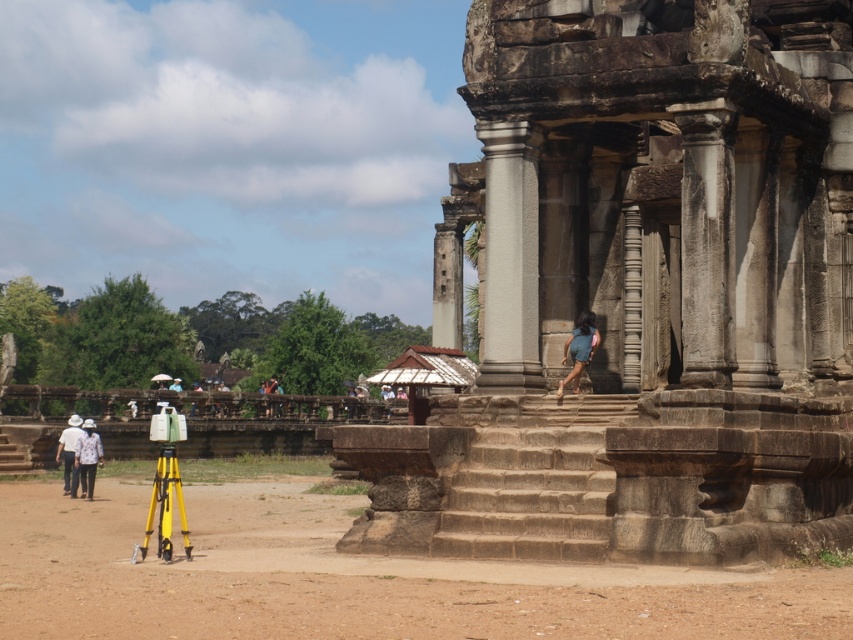
You are an archaeologist standing at point (577, 333). You need to reach point (670, 81) to retrieve a sample. Which direction should you move relative to your current position?

You should move forward because point (670, 81) is in front of point (577, 333).

You are a photographer planning to capture a photo of the gray stone ruins at center and the blue denim shorts at center. Based on their positions, which object should appear higher in the photo?

The gray stone ruins at center is above the blue denim shorts at center, so it will appear higher in the photo.

You are an archaeologist examining the gray stone ruins at center and the blue denim shorts at center in the image. Which object is closer to you?

The gray stone ruins at center is in front of blue denim shorts at center, so it is closer to you.